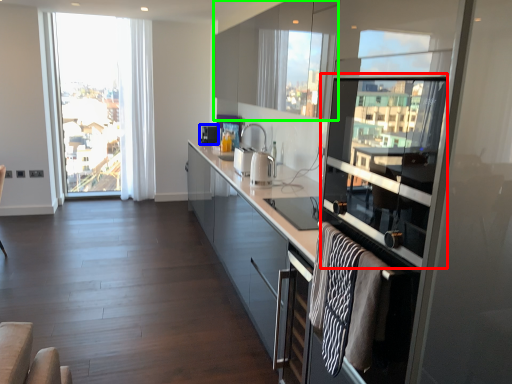
Question: Which object is positioned closest to window screen (highlighted by a red box)? Select from appliance (highlighted by a blue box) and cabinetry (highlighted by a green box).

Choices:
 (A) appliance
 (B) cabinetry

Answer: (B)